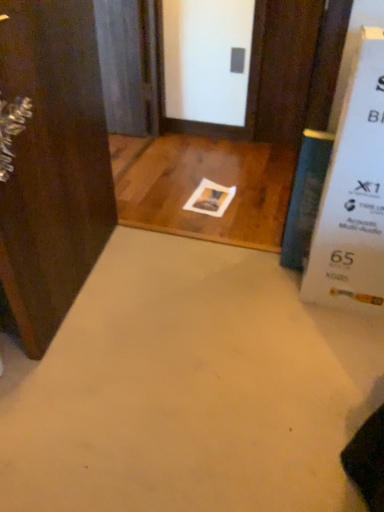
Question: From a real-world perspective, relative to blue glass screen door at upper left, is brown wood door at upper center, which appears as the first door when viewed from the back, vertically above or below?

Choices:
 (A) below
 (B) above

Answer: (B)

Question: Is brown wood door at upper center, which is the 1th door in right-to-left order, bigger or smaller than blue glass screen door at upper left?

Choices:
 (A) big
 (B) small

Answer: (B)

Question: Estimate the real-world distances between objects in this image. Which object is closer to the blue glass screen door at upper left?

Choices:
 (A) brown wood door at upper center, which appears as the first door when viewed from the back
 (B) dark wood door at left, which appears as the first door when viewed from the left

Answer: (A)

Question: Which object is positioned farthest from the blue glass screen door at upper left?

Choices:
 (A) brown wood door at upper center, acting as the first door starting from the top
 (B) dark wood door at left, the 2th door from the back

Answer: (B)